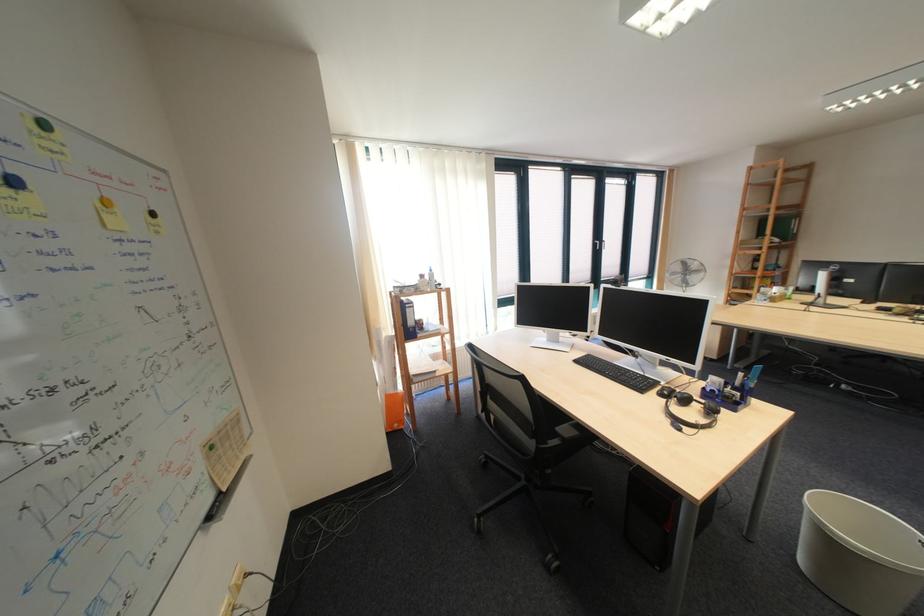
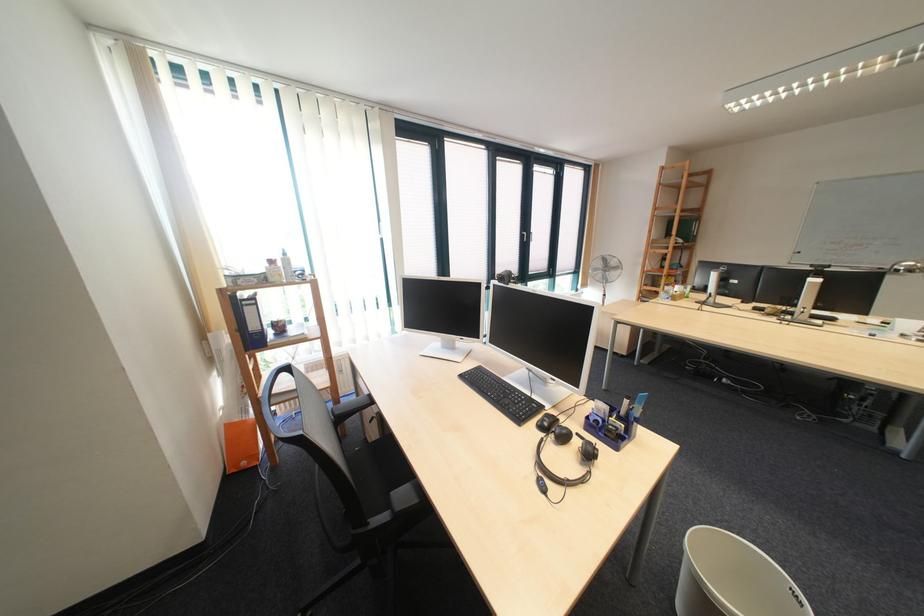
Find the pixel in the second image that matches point 726,392 in the first image.

(611, 423)